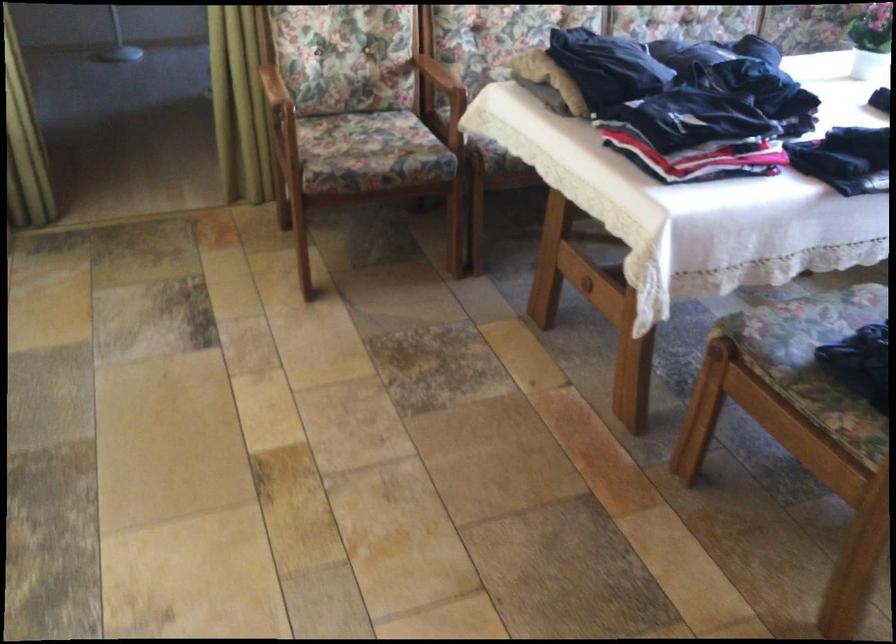
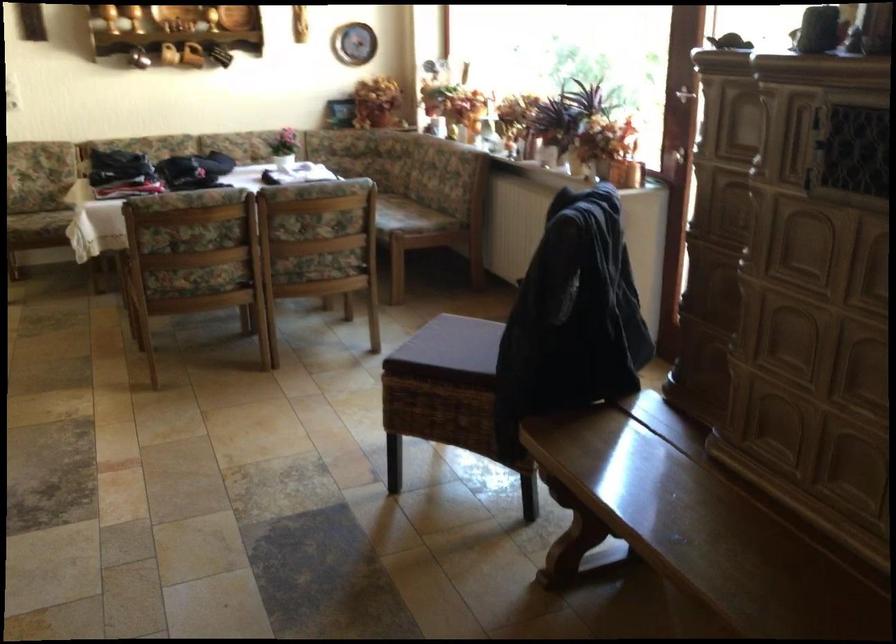
What movement of the cameraman would produce the second image?

The cameraman walked toward right, backward.